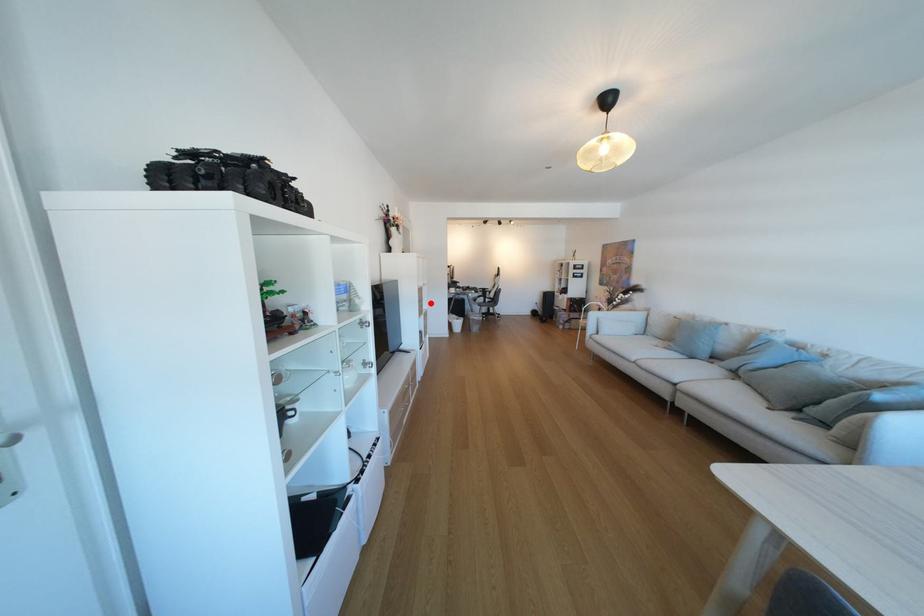
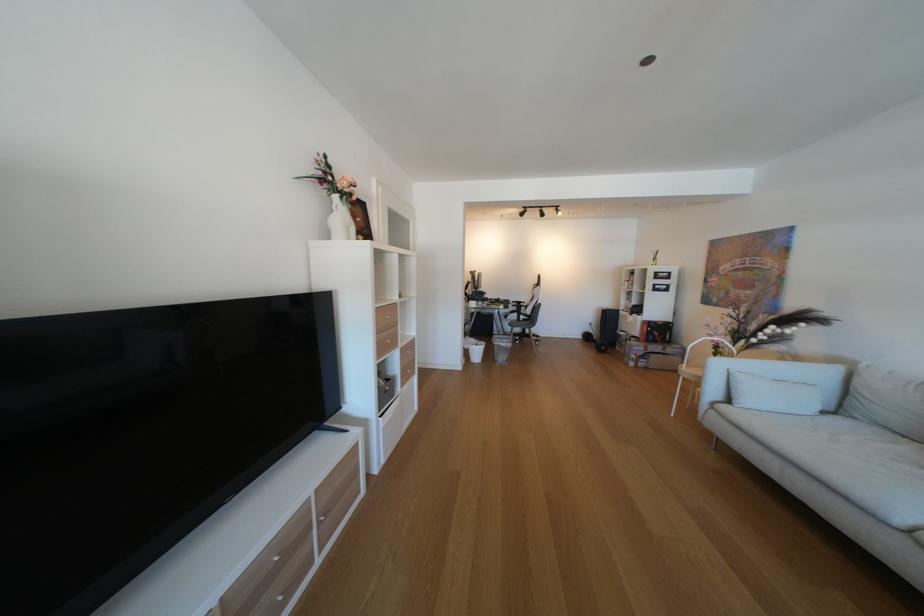
Question: A red point is marked in image1. In image2, is the corresponding 3D point closer to the camera or farther? Reply with the corresponding letter.

Choices:
 (A) The corresponding 3D point is closer.
 (B) The corresponding 3D point is farther.

Answer: (B)